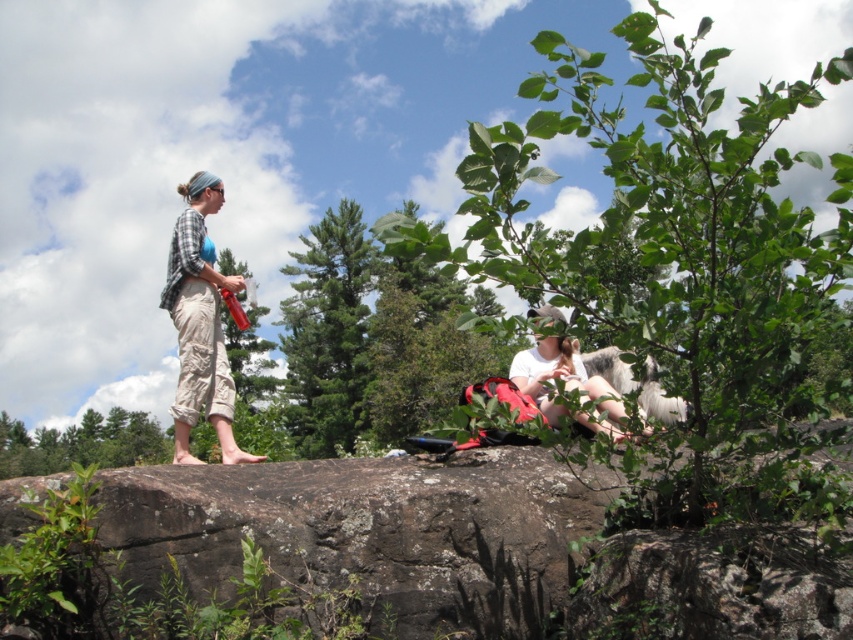
You are a hiker who wants to place a small backpack between the brown rough rock at center and the plaid shirt at left. Based on their positions, which object should you place the backpack closer to to ensure it stays within the scene?

The brown rough rock at center is positioned on the right side of plaid shirt at left, so placing the backpack closer to the plaid shirt at left would keep it within the scene between the two objects.

Looking at this image, you are a hiker trying to decide where to place your backpack. You have two options on the image, the brown rough rock at center and the white cotton shirt at center. Which surface is taller and more suitable for placing your backpack?

The white cotton shirt at center is taller than the brown rough rock at center, so placing the backpack on the white cotton shirt at center would be more suitable.

You are standing at the base of the rock formation and want to place a small flag at the point closest to you. Which point, point (216,412) or point (531,356), should you choose?

Point (216,412) is in front of point (531,356), so you should choose point (216,412) to place the flag closest to you.